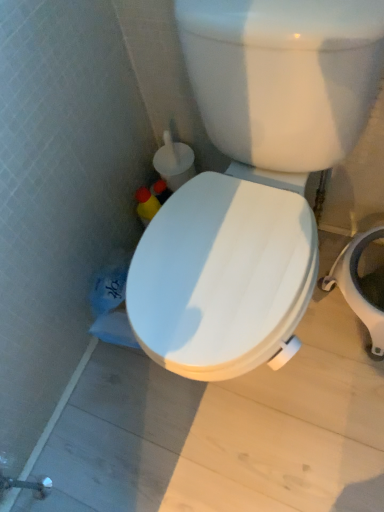
This screenshot has width=384, height=512. Find the location of `vacant space in between white glossy toilet seat at center and white plastic bidet at right`. vacant space in between white glossy toilet seat at center and white plastic bidet at right is located at coordinates (321, 377).